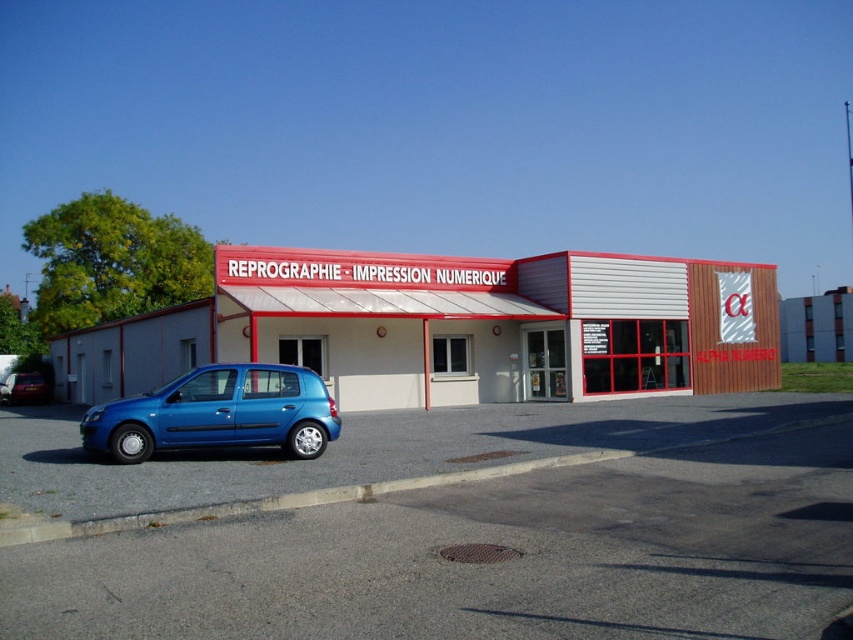
Question: Which point is closer to the camera taking this photo?

Choices:
 (A) (251, 388)
 (B) (26, 387)

Answer: (A)

Question: Is blue metallic hatchback at lower left positioned before blue metallic car at lower left?

Choices:
 (A) yes
 (B) no

Answer: (A)

Question: Among these objects, which one is farthest from the camera?

Choices:
 (A) gray asphalt parking lot at lower left
 (B) blue metallic hatchback at lower left

Answer: (B)

Question: Is gray asphalt parking lot at lower left positioned at the back of blue metallic hatchback at lower left?

Choices:
 (A) no
 (B) yes

Answer: (A)

Question: Which of the following is the farthest from the observer?

Choices:
 (A) blue metallic hatchback at lower left
 (B) gray asphalt parking lot at lower left
 (C) blue metallic car at lower left

Answer: (C)

Question: Is blue metallic hatchback at lower left below blue metallic car at lower left?

Choices:
 (A) no
 (B) yes

Answer: (A)